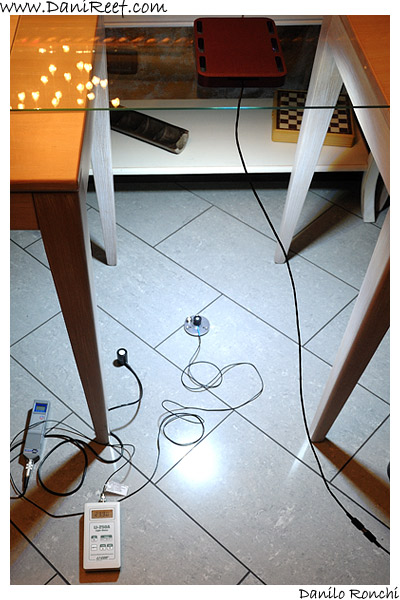
Identify the location of checkers board. This screenshot has height=600, width=400. (286, 126).